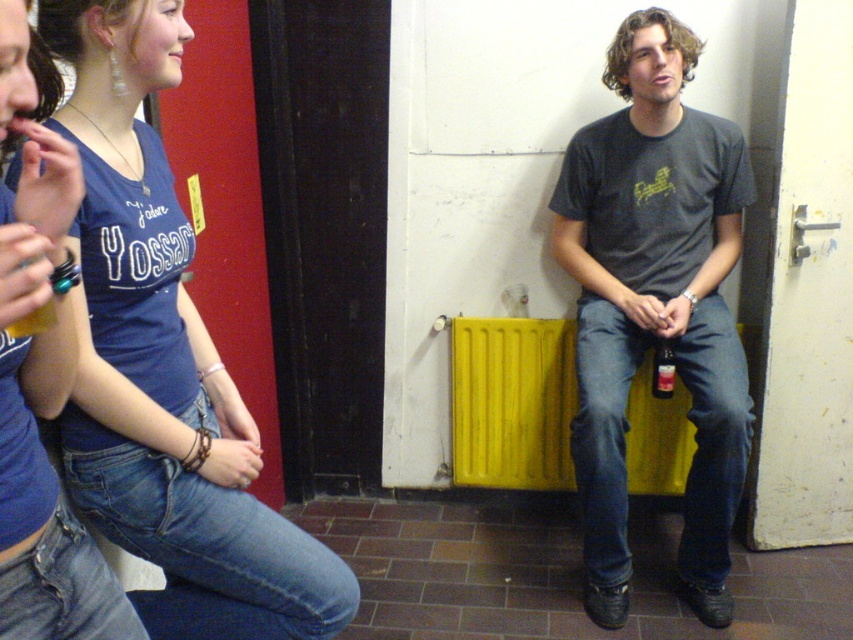
You are standing in the room and want to place a small plant pot exactly where the blue denim jeans at lower left are located. What are the coordinates you should use?

The coordinates for the blue denim jeans at lower left are 0.573 in the x direction and 0.196 in the y direction. So you should place the plant pot at point (166, 365).